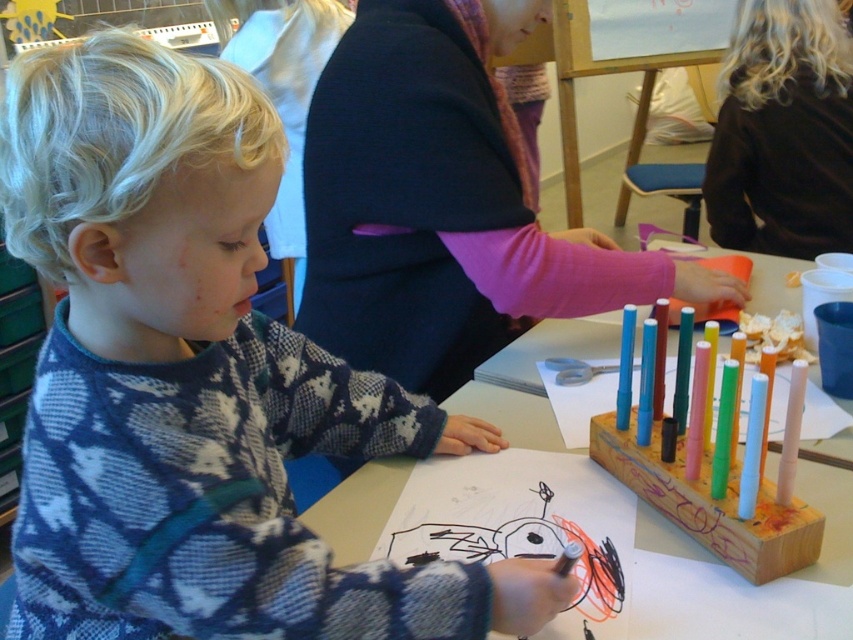
You are standing at the back of the classroom and want to hand out a new set of markers to the child. The markers are placed at point (329, 106) and point (799, 150). Which point is closer to you?

Point (799, 150) is further away from you, so the closer point is point (329, 106).

You are a teacher in the classroom and want to hang a poster on the wall between the black fabric at upper right and the wooden at center. Which object should you place the poster closer to if you want it to be closer to the ceiling?

The black fabric at upper right is taller than the wooden at center, so placing the poster closer to the black fabric at upper right would position it nearer to the ceiling.

You are a teacher in the classroom and need to reach the black fabric at upper right from the knitted sweater at center. Can you safely walk there without stepping on any art supplies?

The distance between the knitted sweater at center and the black fabric at upper right is 1.55 meters, so yes, you can safely walk there without stepping on any art supplies as the distance is sufficient.